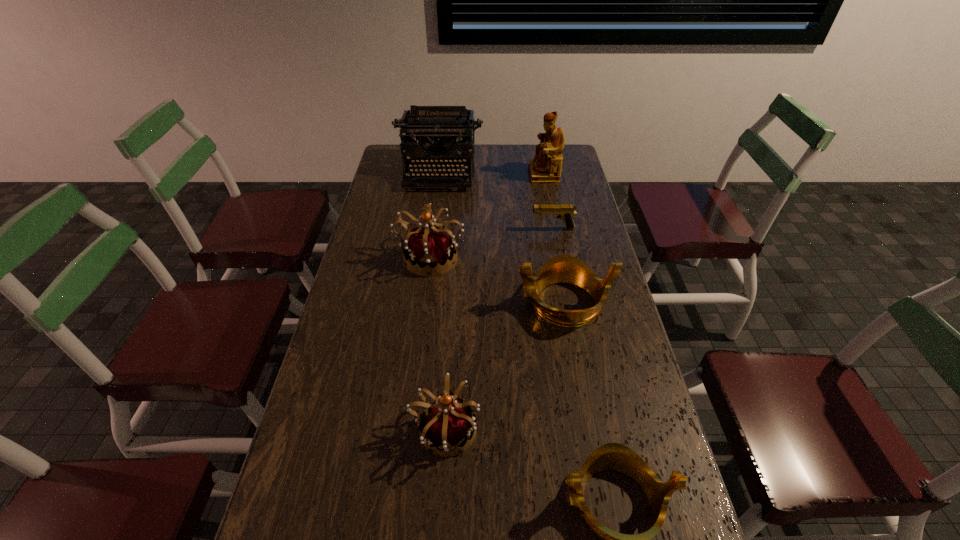
Where is `free spot located on the front-facing side of the figurine`? The image size is (960, 540). free spot located on the front-facing side of the figurine is located at coordinates (454, 174).

Find the location of a particular element. The width and height of the screenshot is (960, 540). free space located on the typing side of the typewriter is located at coordinates (432, 233).

Locate an element on the screen. vacant point located 0.120m on the front-facing side of the tallest tiara is located at coordinates (424, 306).

Where is `free space located 0.130m on the front-facing side of the nearer red tiara`? free space located 0.130m on the front-facing side of the nearer red tiara is located at coordinates (533, 429).

Where is `vacant space located at the front emblem of the farther gold tiara`? This screenshot has height=540, width=960. vacant space located at the front emblem of the farther gold tiara is located at coordinates (500, 302).

Locate an element on the screen. This screenshot has width=960, height=540. free location located 0.080m at the front emblem of the farther gold tiara is located at coordinates (491, 302).

This screenshot has height=540, width=960. I want to click on free region located at the front emblem of the farther gold tiara, so click(x=411, y=302).

You are a GUI agent. You are given a task and a screenshot of the screen. Output one action in this format:
    pyautogui.click(x=<x>, y=<y>)
    Task: Click on the free space located 0.150m at the barrel of the pistol
    This screenshot has width=960, height=540.
    Given the screenshot: What is the action you would take?
    pyautogui.click(x=491, y=229)

This screenshot has width=960, height=540. What are the coordinates of `free space located at the barrel of the pistol` in the screenshot? It's located at (501, 229).

Locate an element on the screen. vacant area located at the barrel of the pistol is located at coordinates (440, 229).